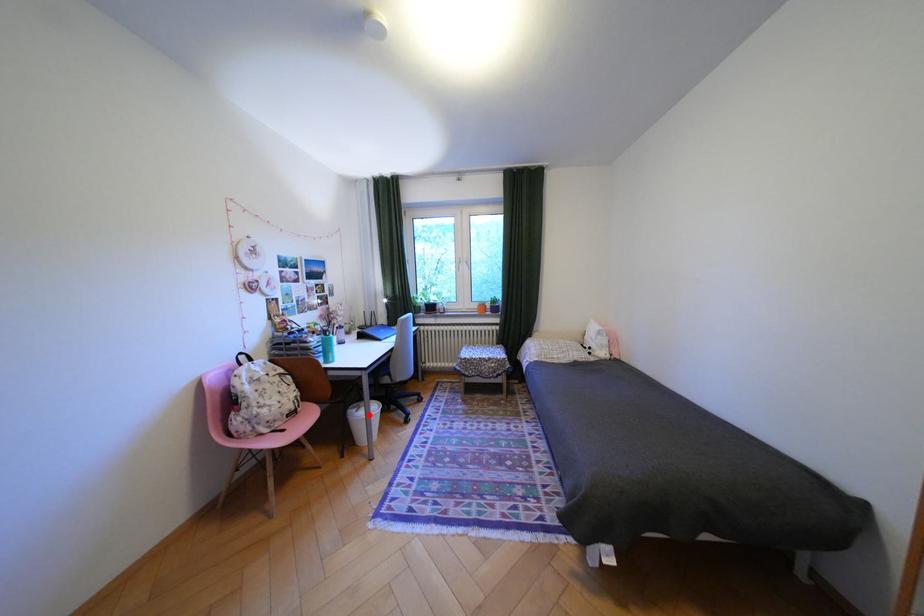
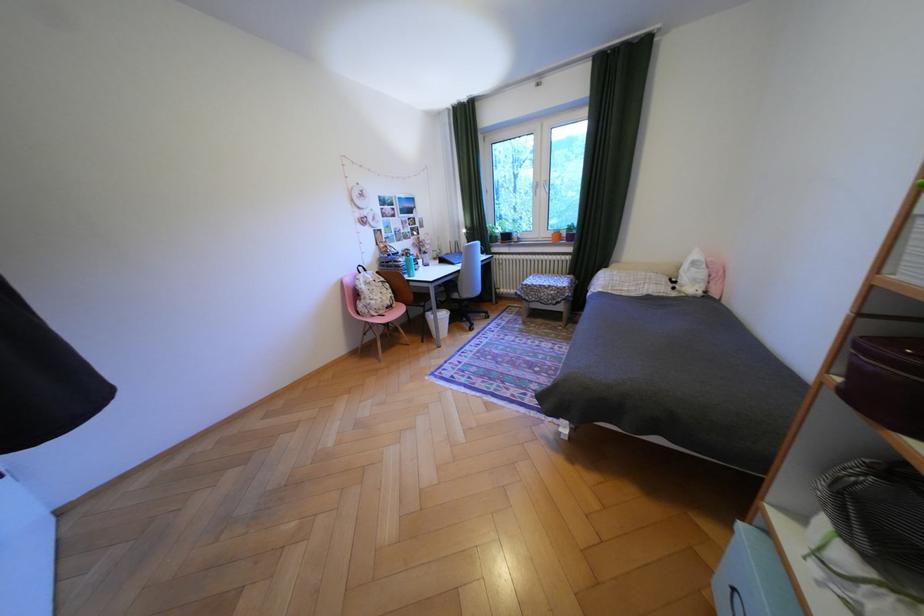
Question: I am providing you with two images of the same scene from different viewpoints. Given a red point in image1, look at the same physical point in image2. Is it:

Choices:
 (A) Closer to the viewpoint
 (B) Farther from the viewpoint

Answer: (A)